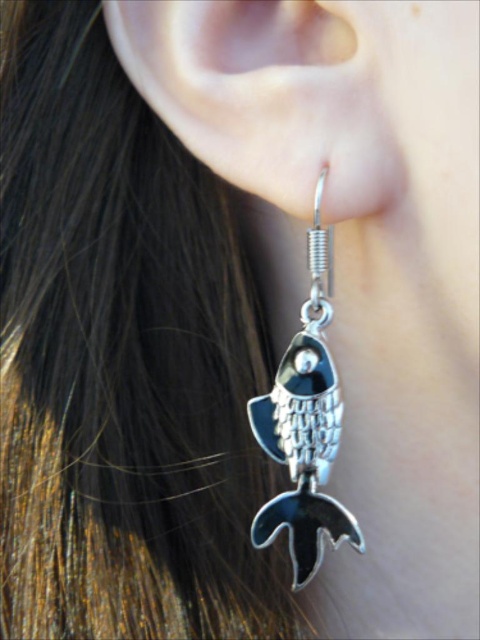
You are an appraiser examining the image of an earring. You need to determine if the silver metallic earring at center will fit into a display case that can only accommodate items shorter than the silver metallic fish at lower left. Can it fit?

The silver metallic earring at center has a lesser height compared to the silver metallic fish at lower left, so it can fit into the display case designed for items shorter than the fish.

You are a jeweler who needs to determine if the silver metallic fish at lower left can be attached to the silver metallic earring at center without overlapping. Based on their sizes, can the fish be attached to the earring?

The silver metallic earring at center has a larger size compared to silver metallic fish at lower left, so the fish can be attached to the earring without overlapping since it is smaller in size.

What are the coordinates of the silver metallic earring at center?

The silver metallic earring at center is located at coordinates point (265, 99).